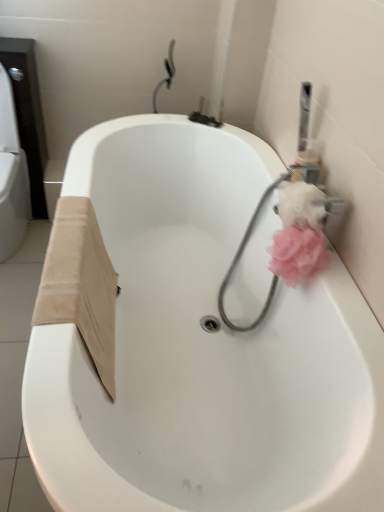
Where is `pink fabric bath puff at right`? pink fabric bath puff at right is located at coordinates (280, 256).

Describe the element at coordinates (298, 254) in the screenshot. I see `pink fluffy loofah at right` at that location.

Find the location of a particular element. This screenshot has height=512, width=384. pink fluffy toilet paper at upper right is located at coordinates (301, 205).

Is point (320, 198) behind point (314, 258)?

That is True.

Considering the sizes of objects pink fluffy toilet paper at upper right and pink fluffy loofah at right in the image provided, who is taller, pink fluffy toilet paper at upper right or pink fluffy loofah at right?

pink fluffy loofah at right is taller.

How much distance is there between pink fluffy toilet paper at upper right and pink fluffy loofah at right?

They are 3.08 inches apart.

Can you see pink fluffy toilet paper at upper right touching pink fluffy loofah at right?

Yes, pink fluffy toilet paper at upper right is with pink fluffy loofah at right.

Is pink fabric bath puff at right oriented towards pink fluffy loofah at right?

No, pink fabric bath puff at right is not facing towards pink fluffy loofah at right.

From the image's perspective, which object appears higher, pink fabric bath puff at right or pink fluffy loofah at right?

pink fabric bath puff at right, from the image's perspective.

Does pink fabric bath puff at right have a lesser width compared to pink fluffy loofah at right?

In fact, pink fabric bath puff at right might be wider than pink fluffy loofah at right.

From the image's perspective, which object appears higher, white glossy bathtub at center or pink fluffy loofah at right?

pink fluffy loofah at right appears higher in the image.

I want to click on flower located behind the white glossy bathtub at center, so click(x=298, y=254).

Between white glossy bathtub at center and pink fluffy loofah at right, which one appears on the right side from the viewer's perspective?

Positioned to the right is pink fluffy loofah at right.

Between white glossy bathtub at center and pink fluffy loofah at right, which one has smaller size?

pink fluffy loofah at right is smaller.

Is pink fabric bath puff at right bigger or smaller than white glossy bathtub at center?

Clearly, pink fabric bath puff at right is smaller in size than white glossy bathtub at center.

How different are the orientations of pink fabric bath puff at right and white glossy bathtub at center in degrees?

0.347 degrees separate the facing orientations of pink fabric bath puff at right and white glossy bathtub at center.

Would you say pink fabric bath puff at right is outside white glossy bathtub at center?

Actually, pink fabric bath puff at right is within white glossy bathtub at center.

Between pink fabric bath puff at right and white glossy bathtub at center, which one appears on the right side from the viewer's perspective?

From the viewer's perspective, pink fabric bath puff at right appears more on the right side.

Consider the image. What's the angular difference between pink fabric bath puff at right and pink fluffy toilet paper at upper right's facing directions?

The angle between the facing direction of pink fabric bath puff at right and the facing direction of pink fluffy toilet paper at upper right is 84.8 degrees.

From the image's perspective, is pink fabric bath puff at right positioned above or below pink fluffy toilet paper at upper right?

Clearly, from the image's perspective, pink fabric bath puff at right is below pink fluffy toilet paper at upper right.

Is pink fabric bath puff at right to the right of pink fluffy toilet paper at upper right from the viewer's perspective?

Incorrect, pink fabric bath puff at right is not on the right side of pink fluffy toilet paper at upper right.

Between pink fabric bath puff at right and pink fluffy toilet paper at upper right, which one is positioned behind?

pink fabric bath puff at right.

Is white glossy bathtub at center inside pink fluffy loofah at right?

No.

Which is further, (x=288, y=242) or (x=309, y=389)?

Point (x=309, y=389)

From a real-world perspective, is pink fluffy loofah at right located higher than white glossy bathtub at center?

Correct, in the physical world, pink fluffy loofah at right is higher than white glossy bathtub at center.

Considering the relative sizes of pink fluffy loofah at right and white glossy bathtub at center in the image provided, is pink fluffy loofah at right bigger than white glossy bathtub at center?

Incorrect, pink fluffy loofah at right is not larger than white glossy bathtub at center.

How many degrees apart are the facing directions of white glossy bathtub at center and pink fluffy toilet paper at upper right?

They differ by 84.5 degrees in their facing directions.

Locate an element on the screen. bathtub on the left side of pink fluffy toilet paper at upper right is located at coordinates (206, 352).

Is white glossy bathtub at center with pink fluffy toilet paper at upper right?

white glossy bathtub at center and pink fluffy toilet paper at upper right are not in contact.

At what (x,y) coordinates should I click in order to perform the action: click on flower in front of the pink fluffy toilet paper at upper right. Please return your answer as a coordinate pair (x, y). This screenshot has height=512, width=384. Looking at the image, I should click on (298, 254).

Identify the location of plumbing fixture on the left of pink fluffy loofah at right. The width and height of the screenshot is (384, 512). (280, 256).

From the image, which object appears to be farther from pink fluffy loofah at right, pink fabric bath puff at right or white glossy bathtub at center?

Among the two, white glossy bathtub at center is located further to pink fluffy loofah at right.

Estimate the real-world distances between objects in this image. Which object is further from white glossy bathtub at center, pink fluffy loofah at right or pink fluffy toilet paper at upper right?

pink fluffy toilet paper at upper right is further to white glossy bathtub at center.

Consider the image. From the image, which object appears to be farther from pink fluffy toilet paper at upper right, white glossy bathtub at center or pink fabric bath puff at right?

Among the two, white glossy bathtub at center is located further to pink fluffy toilet paper at upper right.

Considering their positions, is pink fluffy toilet paper at upper right positioned closer to pink fabric bath puff at right than pink fluffy loofah at right?

Based on the image, pink fluffy loofah at right appears to be nearer to pink fabric bath puff at right.

Which object lies nearer to the anchor point pink fluffy loofah at right, white glossy bathtub at center or pink fabric bath puff at right?

pink fabric bath puff at right is closer to pink fluffy loofah at right.

Which object lies nearer to the anchor point white glossy bathtub at center, pink fluffy loofah at right or pink fabric bath puff at right?

Among the two, pink fabric bath puff at right is located nearer to white glossy bathtub at center.

Which object lies further to the anchor point pink fabric bath puff at right, pink fluffy loofah at right or white glossy bathtub at center?

Among the two, white glossy bathtub at center is located further to pink fabric bath puff at right.

From the image, which object appears to be farther from pink fluffy toilet paper at upper right, pink fluffy loofah at right or pink fabric bath puff at right?

Among the two, pink fabric bath puff at right is located further to pink fluffy toilet paper at upper right.

I want to click on toilet paper between white glossy bathtub at center and pink fabric bath puff at right along the z-axis, so (301, 205).

Identify the location of flower between white glossy bathtub at center and pink fluffy toilet paper at upper right along the z-axis. Image resolution: width=384 pixels, height=512 pixels. (298, 254).

I want to click on flower positioned between white glossy bathtub at center and pink fabric bath puff at right from near to far, so click(298, 254).

Identify the location of plumbing fixture that lies between pink fluffy toilet paper at upper right and pink fluffy loofah at right from top to bottom. The width and height of the screenshot is (384, 512). (280, 256).